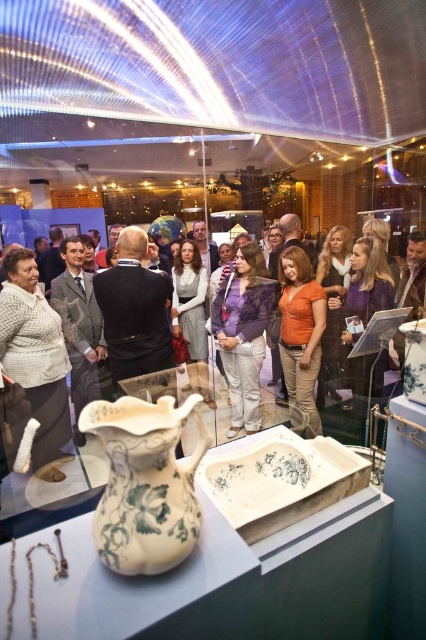
Question: Which point appears farthest from the camera in this image?

Choices:
 (A) (57, 432)
 (B) (261, 259)
 (C) (316, 340)

Answer: (B)

Question: Which point is farther to the camera?

Choices:
 (A) (342, 248)
 (B) (115, 532)
 (C) (313, 419)
 (D) (213, 326)

Answer: (A)

Question: Where is matte black jacket at center located in relation to purple lace blouse at center in the image?

Choices:
 (A) right
 (B) left

Answer: (A)

Question: Estimate the real-world distances between objects in this image. Which object is farther from the orange cotton shirt at center?

Choices:
 (A) white glossy vase at center
 (B) matte black jacket at center
 (C) white knitted sweater at left
 (D) purple lace blouse at center

Answer: (A)

Question: Can you confirm if white glossy vase at center is positioned to the right of purple lace blouse at center?

Choices:
 (A) no
 (B) yes

Answer: (A)

Question: Is purple lace blouse at center closer to camera compared to orange cotton shirt at center?

Choices:
 (A) no
 (B) yes

Answer: (A)